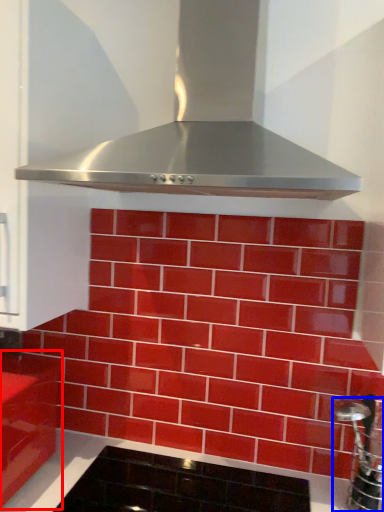
Question: Which of the following is the farthest to the observer, cabinetry (highlighted by a red box) or stainless steel (highlighted by a blue box)?

Choices:
 (A) cabinetry
 (B) stainless steel

Answer: (A)